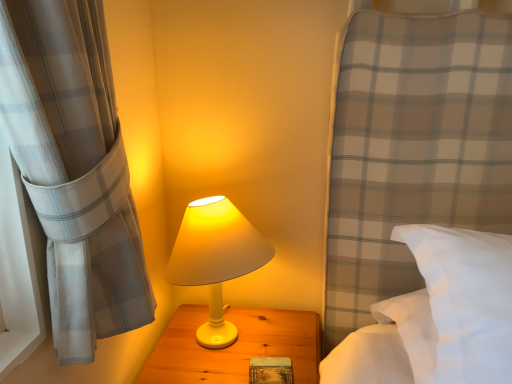
This screenshot has height=384, width=512. Identify the location of free space behind white matte lamp at center. (230, 306).